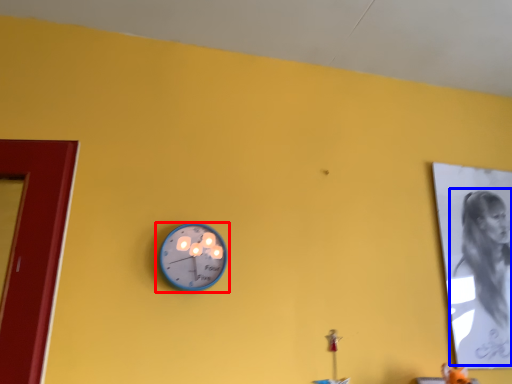
Question: Which of the following is the closest to the observer, wall clock (highlighted by a red box) or person (highlighted by a blue box)?

Choices:
 (A) wall clock
 (B) person

Answer: (A)